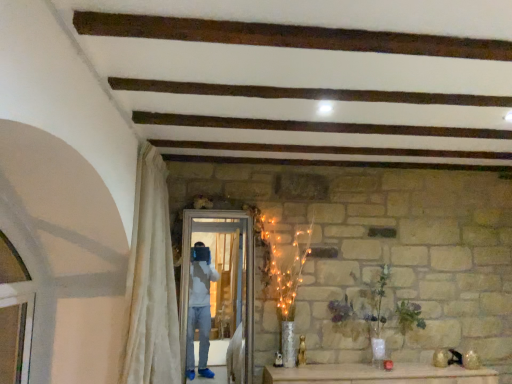
Question: Is white glossy screen door at center completely or partially inside green matte vase at center?

Choices:
 (A) yes
 (B) no

Answer: (B)

Question: Does green matte vase at center come behind white glossy screen door at center?

Choices:
 (A) yes
 (B) no

Answer: (A)

Question: Does green matte vase at center appear on the right side of white glossy screen door at center?

Choices:
 (A) no
 (B) yes

Answer: (B)

Question: Can you confirm if green matte vase at center is taller than white glossy screen door at center?

Choices:
 (A) no
 (B) yes

Answer: (A)

Question: Is green matte vase at center far away from white glossy screen door at center?

Choices:
 (A) no
 (B) yes

Answer: (A)

Question: Could you tell me if green matte vase at center is turned towards white glossy screen door at center?

Choices:
 (A) no
 (B) yes

Answer: (A)

Question: Does green matte vase at center turn towards white sheer curtain at left?

Choices:
 (A) no
 (B) yes

Answer: (A)

Question: Is green matte vase at center wider than white sheer curtain at left?

Choices:
 (A) no
 (B) yes

Answer: (A)

Question: Is green matte vase at center outside of white sheer curtain at left?

Choices:
 (A) no
 (B) yes

Answer: (B)

Question: Does green matte vase at center have a lesser height compared to white sheer curtain at left?

Choices:
 (A) yes
 (B) no

Answer: (A)

Question: Is green matte vase at center positioned before white sheer curtain at left?

Choices:
 (A) yes
 (B) no

Answer: (B)

Question: Considering the relative sizes of green matte vase at center and white sheer curtain at left in the image provided, is green matte vase at center smaller than white sheer curtain at left?

Choices:
 (A) yes
 (B) no

Answer: (A)

Question: Is white sheer curtain at left wider than green matte vase at center?

Choices:
 (A) yes
 (B) no

Answer: (A)